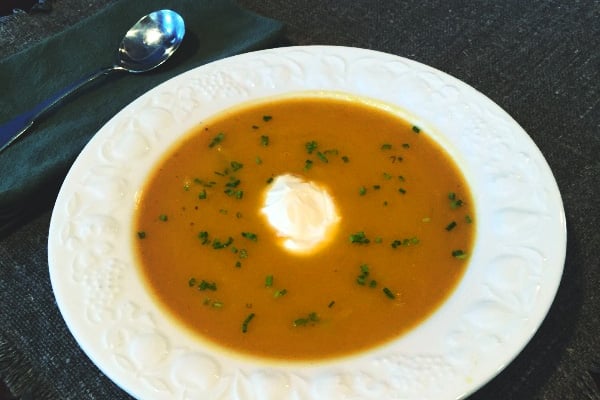
Where is `handle`? Image resolution: width=600 pixels, height=400 pixels. handle is located at coordinates (79, 84), (51, 102), (27, 116).